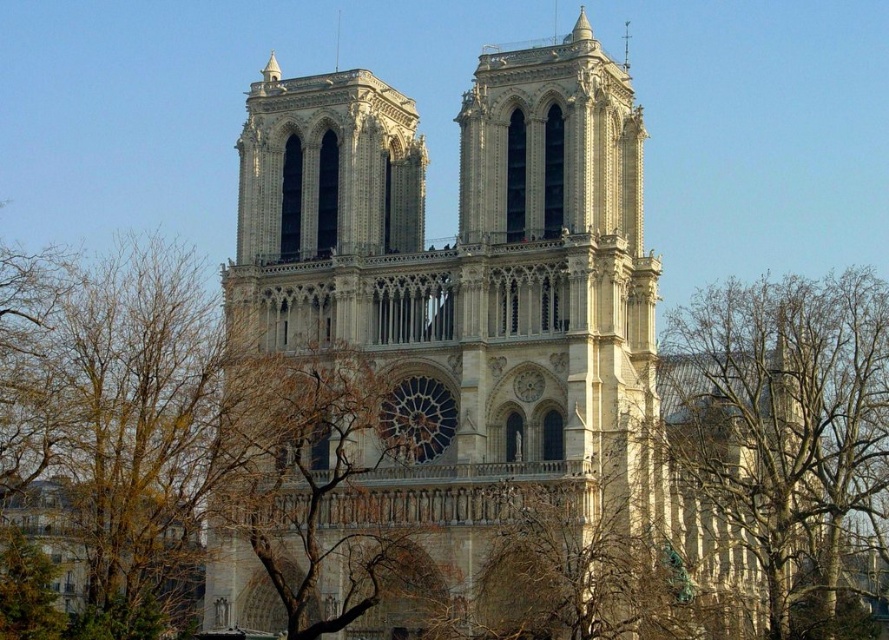
You are a photographer planning to capture the Notre Dame Cathedral with both the brown leafy tree at left and the brown leafless branches at center in the frame. Which tree has a wider spread that might require adjusting your camera angle to include it fully?

The brown leafy tree at left has a wider spread than the brown leafless branches at center, so you should adjust your camera angle to accommodate its width.

You are standing in front of the Notre Dame Cathedral and notice the stone cathedral at center and the bare branches at right. From your perspective, which object is positioned to the left?

The stone cathedral at center is positioned to the left of the bare branches at right.

You are standing in front of the Notre Dame Cathedral and want to take a photo that includes both the brown leafy tree at left and the central rose window. Based on their positions, where should you position yourself to ensure both elements are in the frame?

Since the brown leafy tree at left is located at point (x=142, y=419) in the image, positioning yourself slightly to the right of the cathedral while keeping the tree within the left side of your frame will allow the central rose window to be centered, ensuring both elements are captured in the photo.